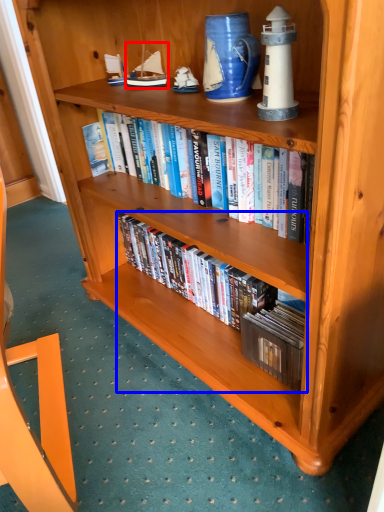
Question: Among these objects, which one is farthest to the camera, toy (highlighted by a red box) or book (highlighted by a blue box)?

Choices:
 (A) toy
 (B) book

Answer: (A)